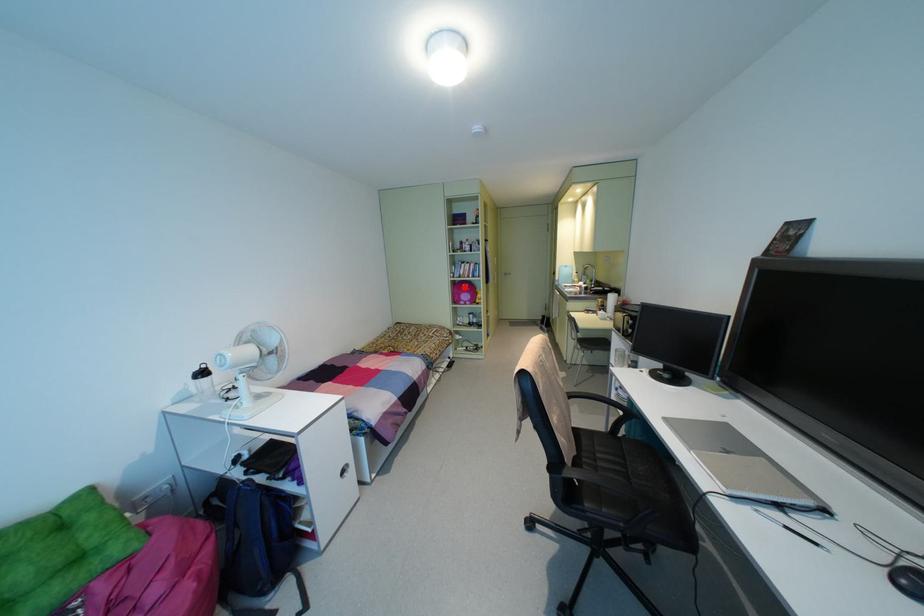
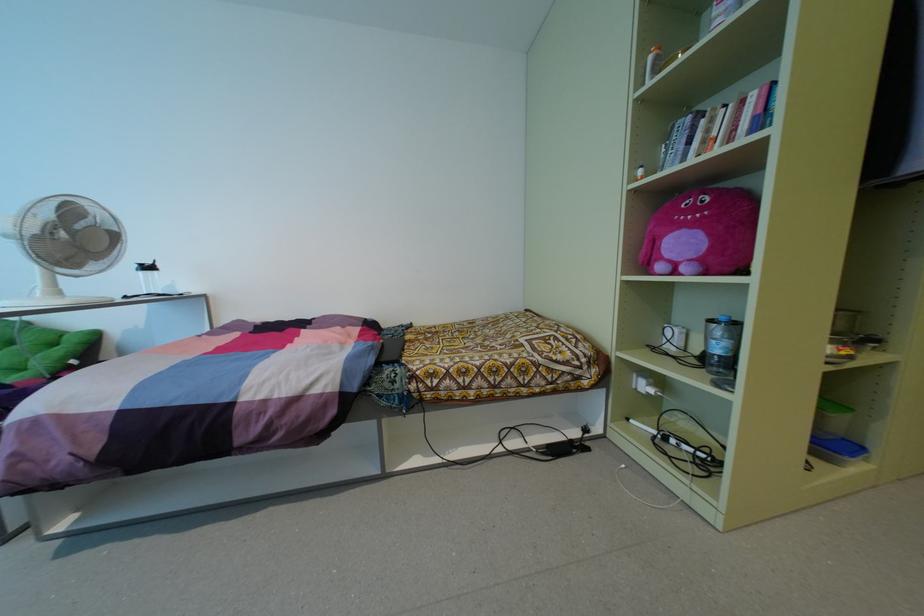
In the second image, find the point that corresponds to the highlighted location in the first image.

(691, 209)